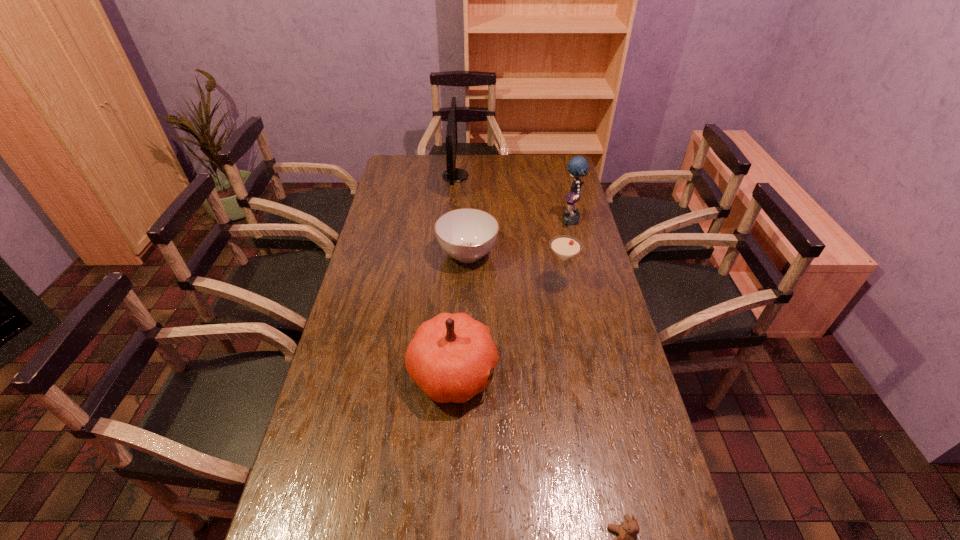
Find the location of `vacant area that lies between the third tallest object and the rag doll`. vacant area that lies between the third tallest object and the rag doll is located at coordinates pos(513,298).

You are a GUI agent. You are given a task and a screenshot of the screen. Output one action in this format:
    pyautogui.click(x=<x>, y=<y>)
    Task: Click on the vacant space that is in between the second nearest object and the rag doll
    
    Given the screenshot: What is the action you would take?
    pyautogui.click(x=513, y=298)

At what (x,y) coordinates should I click in order to perform the action: click on free space that is in between the second farthest object and the farthest object. Please return your answer as a coordinate pair (x, y). The image size is (960, 540). Looking at the image, I should click on 514,199.

Locate an element on the screen. unoccupied area between the fifth tallest object and the second farthest object is located at coordinates (519, 238).

Locate which object is the closest to the nearest object. Please provide its 2D coordinates. Your answer should be formatted as a tuple, i.e. [(x, y)], where the tuple contains the x and y coordinates of a point satisfying the conditions above.

[(450, 357)]

Find the location of a particular element. The height and width of the screenshot is (540, 960). the fourth closest object to the fifth nearest object is located at coordinates (450, 357).